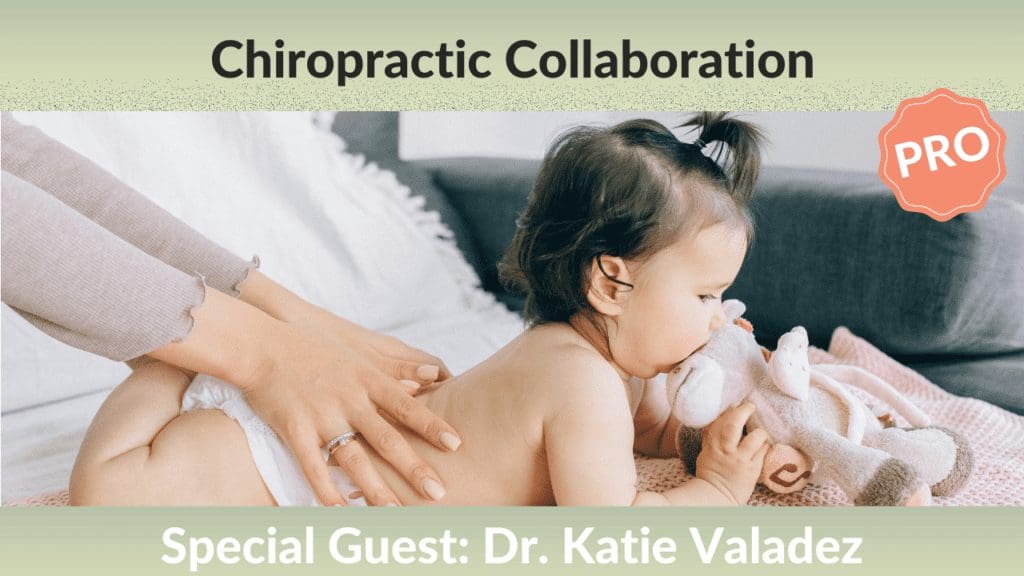
You are a GUI agent. You are given a task and a screenshot of the screen. Output one action in this format:
    pyautogui.click(x=<x>, y=<y>)
    Task: Click on the grey wall
    The height and width of the screenshot is (576, 1024).
    Given the screenshot: What is the action you would take?
    pyautogui.click(x=1009, y=142), pyautogui.click(x=828, y=143), pyautogui.click(x=454, y=128)